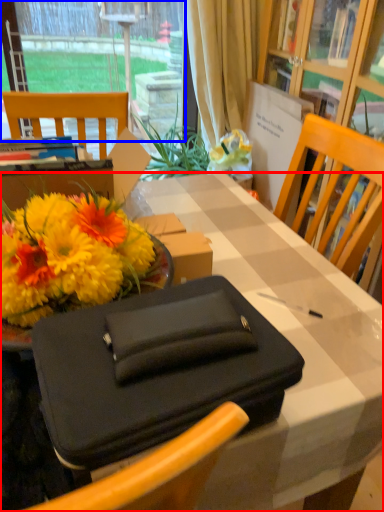
Question: Which of the following is the closest to the observer, desk (highlighted by a red box) or window (highlighted by a blue box)?

Choices:
 (A) desk
 (B) window

Answer: (A)